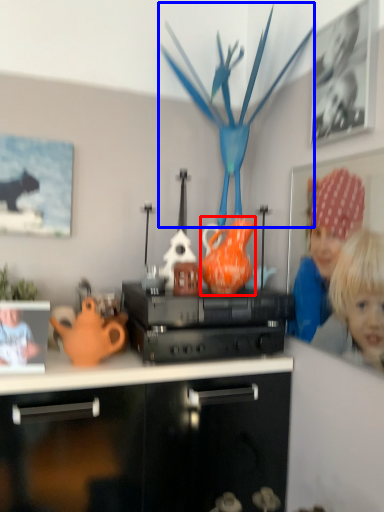
Question: Which object appears farthest to the camera in this image, tea pot (highlighted by a red box) or toy (highlighted by a blue box)?

Choices:
 (A) tea pot
 (B) toy

Answer: (A)